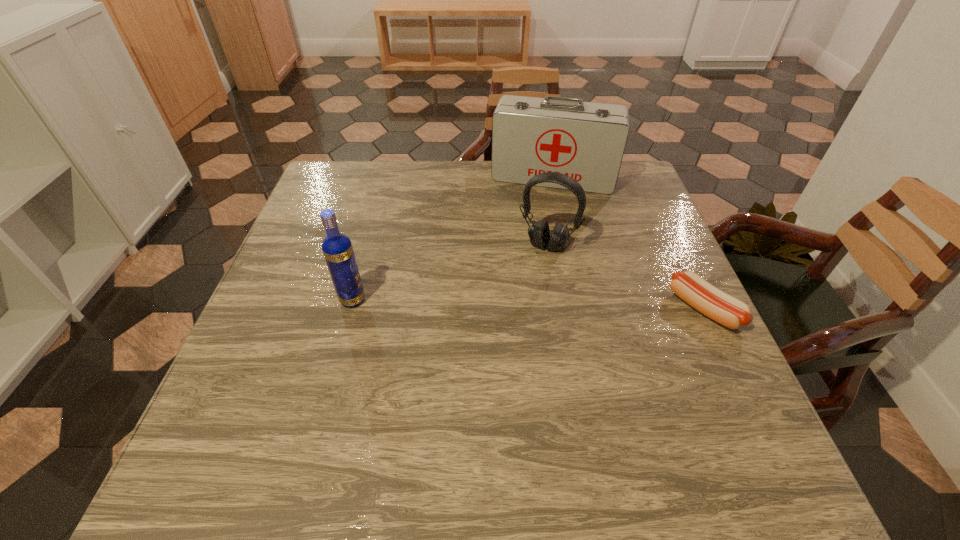
Where is `free space located 0.280m on the front-facing side of the first-aid kit`? free space located 0.280m on the front-facing side of the first-aid kit is located at coordinates (530, 261).

You are a GUI agent. You are given a task and a screenshot of the screen. Output one action in this format:
    pyautogui.click(x=<x>, y=<y>)
    Task: Click on the vacant space located on the front-facing side of the first-aid kit
    
    Given the screenshot: What is the action you would take?
    pyautogui.click(x=540, y=205)

The width and height of the screenshot is (960, 540). Identify the location of free space located 0.140m on the front-facing side of the first-aid kit. (537, 225).

Where is `object situated at the far edge`? This screenshot has width=960, height=540. object situated at the far edge is located at coordinates (586, 141).

Locate an element on the screen. sausage present at the right edge is located at coordinates (728, 311).

Locate an element on the screen. the first-aid kit at the right edge is located at coordinates (586, 141).

I want to click on object that is at the far right corner, so click(x=586, y=141).

At what (x,y) coordinates should I click in order to perform the action: click on free space at the far edge of the desktop. Please return your answer as a coordinate pair (x, y). This screenshot has width=960, height=540. Looking at the image, I should click on (512, 187).

Locate an element on the screen. Image resolution: width=960 pixels, height=540 pixels. free space at the near edge is located at coordinates (324, 400).

Find the location of a particular element. vacant space at the left edge of the desktop is located at coordinates (356, 208).